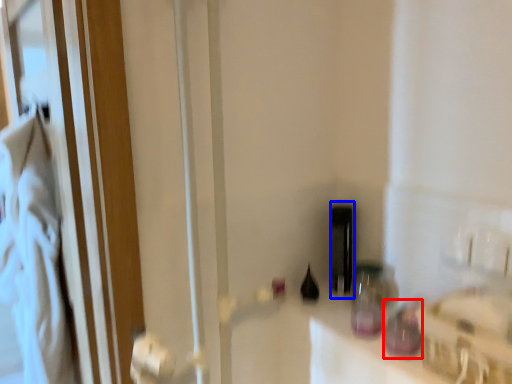
Question: Among these objects, which one is farthest to the camera, bottle (highlighted by a red box) or bottle (highlighted by a blue box)?

Choices:
 (A) bottle
 (B) bottle

Answer: (B)